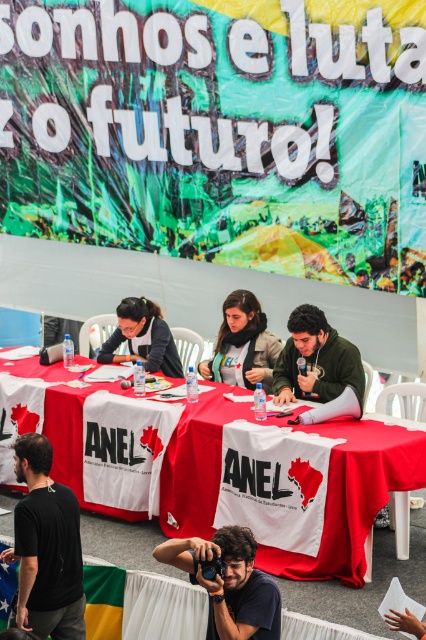
Can you confirm if dark brown leather camera at lower center is smaller than matte black jacket at center?

Yes.

Who is lower down, dark brown leather camera at lower center or matte black jacket at center?

dark brown leather camera at lower center

Does point (270, 589) come closer to viewer compared to point (120, 324)?

Yes.

At what (x,y) coordinates should I click in order to perform the action: click on dark brown leather camera at lower center. Please return your answer as a coordinate pair (x, y). Looking at the image, I should click on (230, 582).

Is black t-shirt at center to the right of dark brown leather camera at lower center from the viewer's perspective?

Incorrect, black t-shirt at center is not on the right side of dark brown leather camera at lower center.

Between black t-shirt at center and dark brown leather camera at lower center, which one appears on the right side from the viewer's perspective?

dark brown leather camera at lower center is more to the right.

The image size is (426, 640). I want to click on black t-shirt at center, so click(x=46, y=547).

This screenshot has height=640, width=426. In order to click on black t-shirt at center in this screenshot , I will do `click(46, 547)`.

Between point (25, 442) and point (117, 312), which one is positioned behind?

The point (117, 312) is more distant.

Is black t-shirt at center to the right of matte black jacket at center from the viewer's perspective?

Incorrect, black t-shirt at center is not on the right side of matte black jacket at center.

Identify the location of black t-shirt at center. The image size is (426, 640). (46, 547).

You are a GUI agent. You are given a task and a screenshot of the screen. Output one action in this format:
    pyautogui.click(x=<x>, y=<y>)
    Task: Click on the black t-shirt at center
    
    Given the screenshot: What is the action you would take?
    pyautogui.click(x=46, y=547)